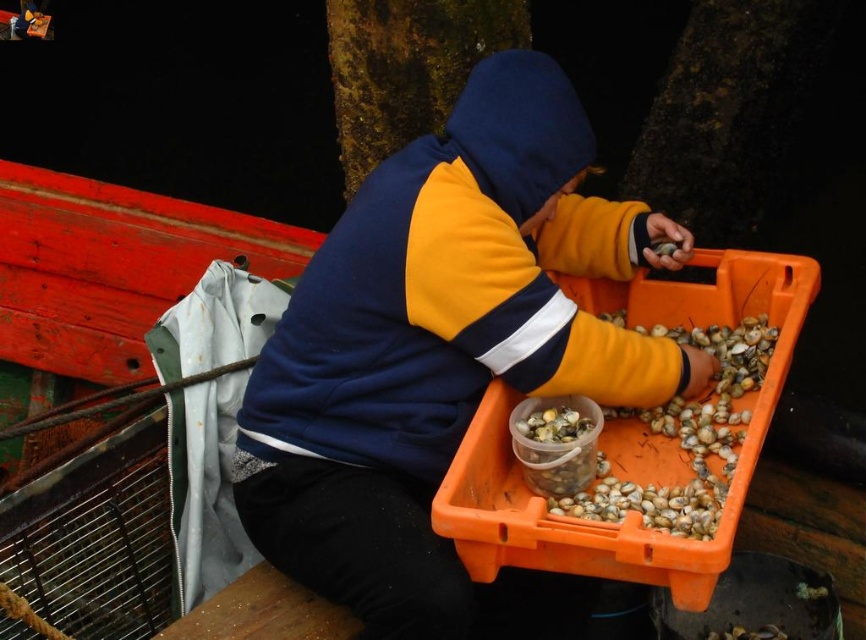
Question: Does matte blue and yellow hoodie at center appear over translucent plastic shells at lower right?

Choices:
 (A) yes
 (B) no

Answer: (A)

Question: Which point is closer to the camera taking this photo?

Choices:
 (A) (399, 420)
 (B) (567, 472)
 (C) (715, 348)

Answer: (B)

Question: Is matte blue and yellow hoodie at center positioned in front of translucent plastic shells at lower right?

Choices:
 (A) no
 (B) yes

Answer: (A)

Question: Can you confirm if matte blue and yellow hoodie at center is positioned to the right of translucent plastic shells at lower right?

Choices:
 (A) no
 (B) yes

Answer: (A)

Question: Which point is farther to the camera?

Choices:
 (A) (522, 401)
 (B) (266, 458)

Answer: (B)

Question: Which object is positioned farthest from the matte blue and yellow hoodie at center?

Choices:
 (A) translucent plastic shells at lower right
 (B) translucent plastic container at center

Answer: (B)